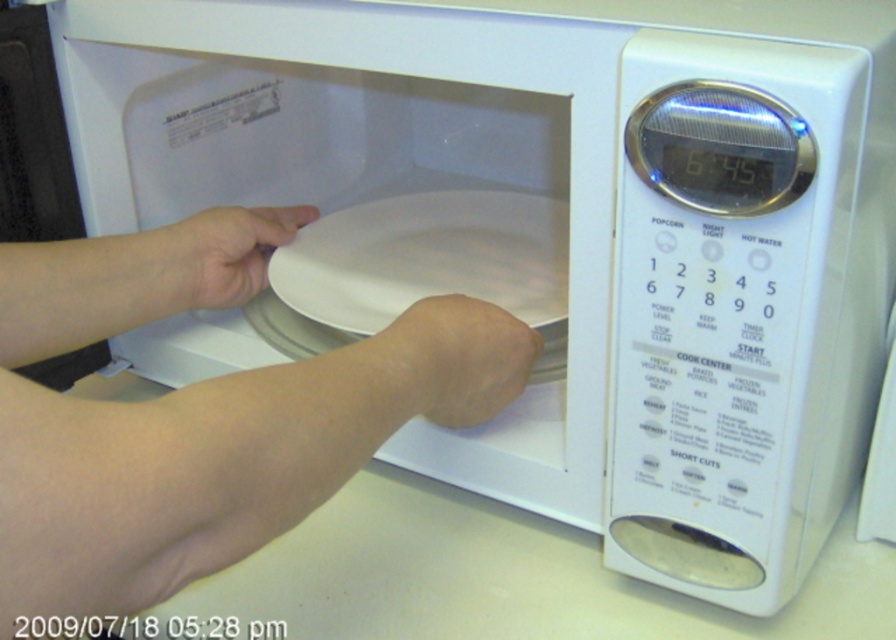
You are a robotic assistant trying to determine the position of the arms to avoid collision. Which arm is closer to you, the skinny white arm at center or the skinny flesh at lower center?

The skinny white arm at center is closer to you because it is in front of the skinny flesh at lower center.